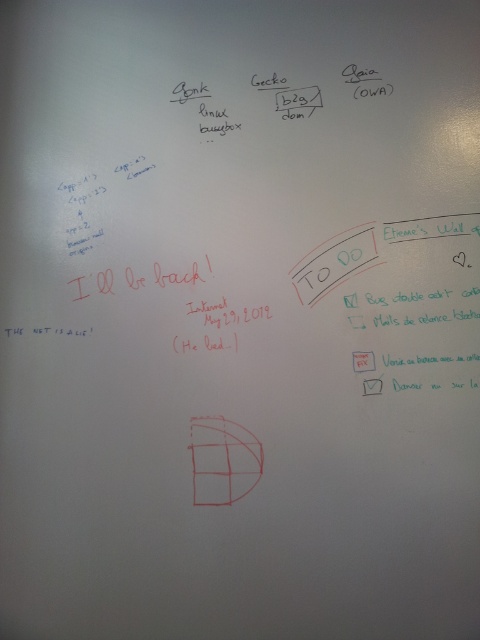
Question: Considering the relative positions of green marker text at center and white paper at center in the image provided, where is green marker text at center located with respect to white paper at center?

Choices:
 (A) above
 (B) below

Answer: (A)

Question: Among these points, which one is nearest to the camera?

Choices:
 (A) (360, 355)
 (B) (354, 264)

Answer: (A)

Question: Observing the image, what is the correct spatial positioning of green marker text at center in reference to white paper at center?

Choices:
 (A) right
 (B) left

Answer: (B)

Question: Which point appears closest to the camera in this image?

Choices:
 (A) (365, 358)
 (B) (328, 252)

Answer: (A)

Question: Can you confirm if green marker text at center is bigger than white paper at center?

Choices:
 (A) no
 (B) yes

Answer: (B)

Question: Which of the following is the closest to the observer?

Choices:
 (A) (313, 250)
 (B) (369, 364)

Answer: (B)